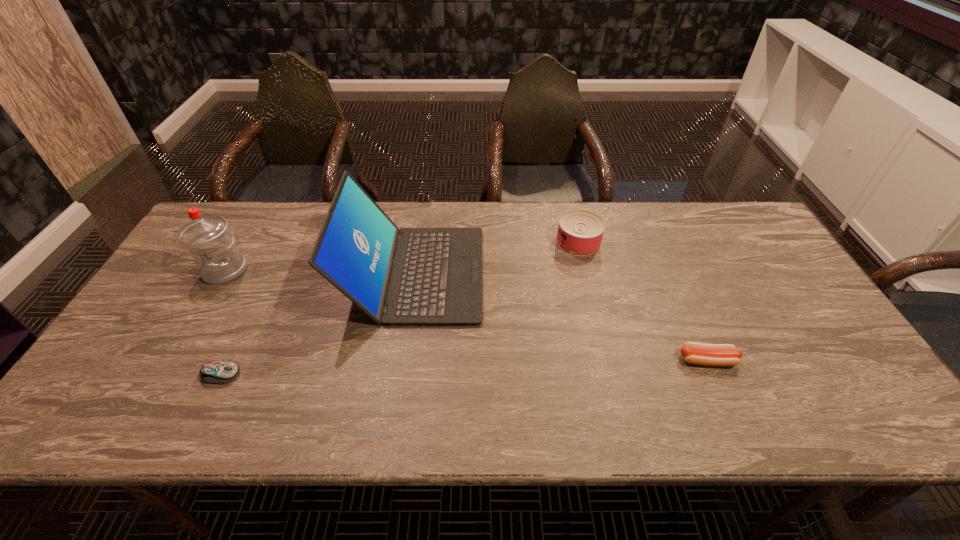
I want to click on vacant region at the far left corner of the desktop, so click(242, 241).

Locate an element on the screen. free space at the far right corner of the desktop is located at coordinates (705, 218).

This screenshot has width=960, height=540. I want to click on free area in between the sausage and the third object from right to left, so click(x=561, y=317).

Identify the location of vacant space in between the third object from right to left and the fourth object from right to left. (318, 324).

At what (x,y) coordinates should I click in order to perform the action: click on empty space between the fourth tallest object and the shortest object. Please return your answer as a coordinate pair (x, y). The image size is (960, 540). Looking at the image, I should click on (465, 367).

Find the location of a particular element. This screenshot has width=960, height=540. vacant area that lies between the sausage and the computer mouse is located at coordinates (x=465, y=367).

The width and height of the screenshot is (960, 540). I want to click on free spot between the rightmost object and the computer mouse, so click(x=465, y=367).

The height and width of the screenshot is (540, 960). I want to click on object that is the closest to the third object from right to left, so click(x=217, y=372).

Point out which object is positioned as the second nearest to the leftmost object. Please provide its 2D coordinates. Your answer should be formatted as a tuple, i.e. [(x, y)], where the tuple contains the x and y coordinates of a point satisfying the conditions above.

[(410, 276)]

Find the location of a particular element. This screenshot has height=540, width=960. free space that satisfies the following two spatial constraints: 1. on the front side of the second shortest object; 2. on the wheel side of the fourth object from right to left is located at coordinates (713, 375).